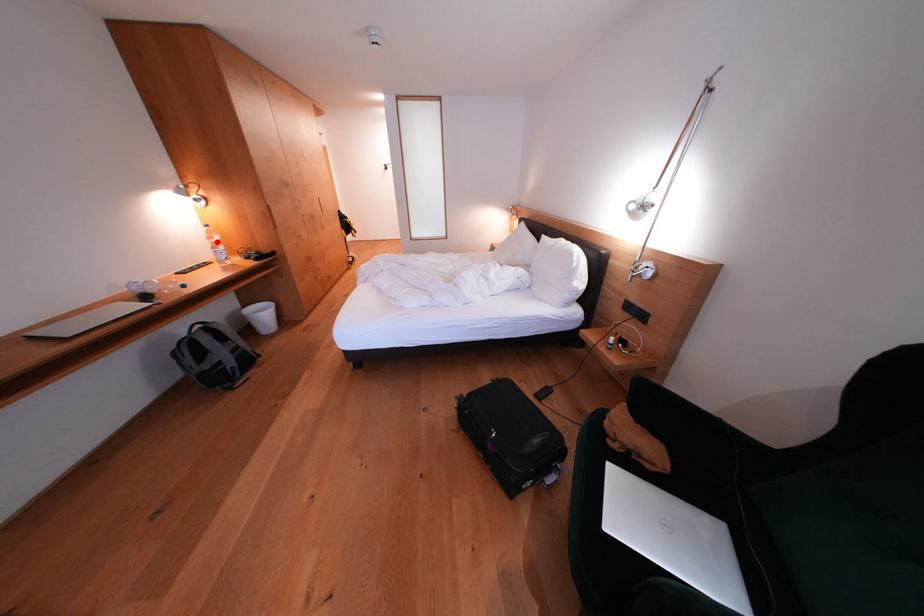
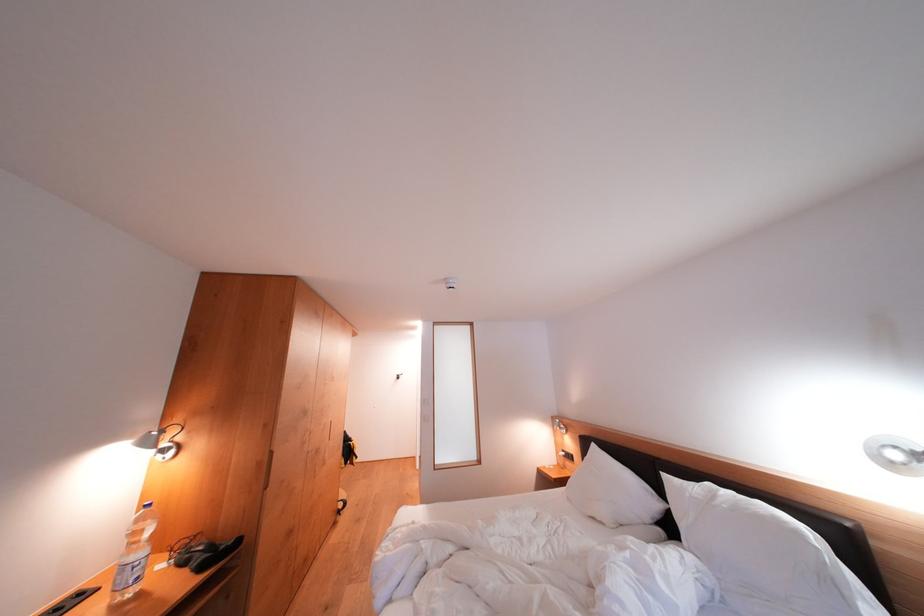
Locate, in the second image, the point that corresponds to the highlighted location in the first image.

(141, 537)